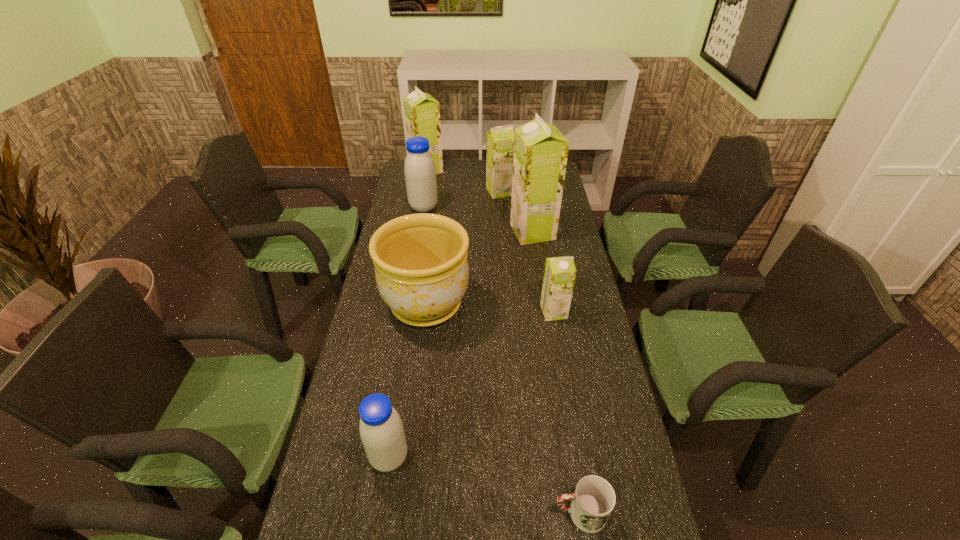
In the image, there is a desktop. Where is `free region at the right edge`? free region at the right edge is located at coordinates (598, 378).

Locate an element on the screen. vacant area at the far left corner of the desktop is located at coordinates (403, 179).

The width and height of the screenshot is (960, 540). I want to click on vacant area that lies between the flowerpot and the tallest object, so click(479, 268).

You are a GUI agent. You are given a task and a screenshot of the screen. Output one action in this format:
    pyautogui.click(x=<x>, y=<y>)
    Task: Click on the vacant region between the nearest soya milk and the second smallest green soya milk
    The width and height of the screenshot is (960, 540).
    Given the screenshot: What is the action you would take?
    pyautogui.click(x=444, y=325)

This screenshot has height=540, width=960. In order to click on empty location between the nearest green soya milk and the tallest soya milk in this screenshot , I will do `click(543, 272)`.

Find the location of `blank region between the third nearest green soya milk and the third farthest soya milk`. blank region between the third nearest green soya milk and the third farthest soya milk is located at coordinates (462, 200).

Locate an element on the screen. The image size is (960, 540). vacant space that is in between the fifth shortest soya milk and the second farthest object is located at coordinates (464, 181).

Where is `free point between the flowerpot and the red cup`? free point between the flowerpot and the red cup is located at coordinates tap(503, 409).

You are a GUI agent. You are given a task and a screenshot of the screen. Output one action in this format:
    pyautogui.click(x=<x>, y=<y>)
    Task: Click on the vacant area between the tallest object and the fourth nearest soya milk
    The width and height of the screenshot is (960, 540).
    Given the screenshot: What is the action you would take?
    pyautogui.click(x=478, y=219)

Where is `vacant area that lies between the nearest green soya milk and the flowerpot`? The width and height of the screenshot is (960, 540). vacant area that lies between the nearest green soya milk and the flowerpot is located at coordinates (490, 308).